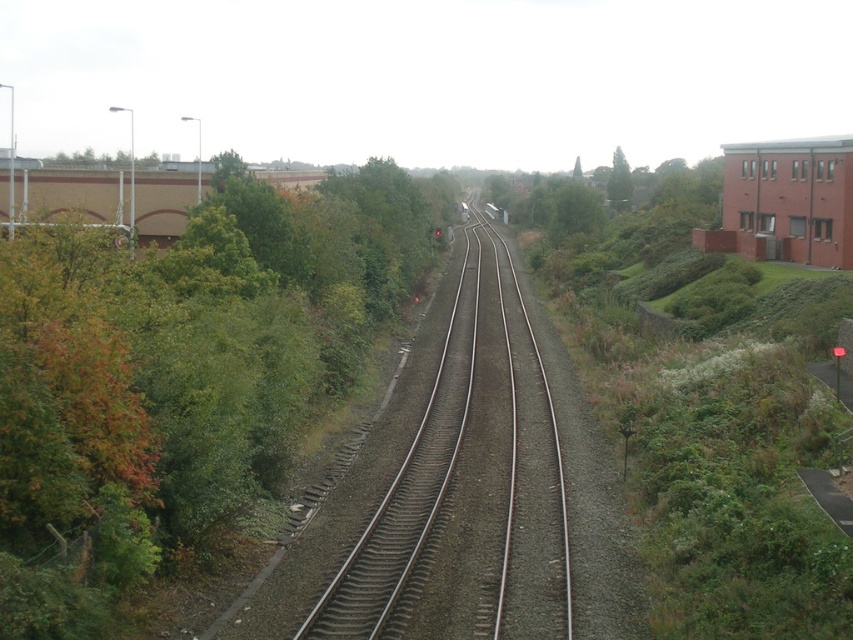
Question: Is green leafy tree at left thinner than green leafy tree at upper center?

Choices:
 (A) yes
 (B) no

Answer: (A)

Question: Which point is closer to the camera?

Choices:
 (A) (474, 602)
 (B) (611, 173)
 (C) (108, 573)

Answer: (C)

Question: Estimate the real-world distances between objects in this image. Which object is farther from the green leafy tree at upper center?

Choices:
 (A) smooth asphalt train track at center
 (B) green leafy tree at left

Answer: (A)

Question: Which point is farther to the camera?

Choices:
 (A) green leafy tree at left
 (B) smooth asphalt train track at center
 (C) green leafy tree at upper center

Answer: (C)

Question: Is the position of green leafy tree at left more distant than that of smooth asphalt train track at center?

Choices:
 (A) yes
 (B) no

Answer: (B)

Question: Observing the image, what is the correct spatial positioning of green leafy tree at left in reference to smooth asphalt train track at center?

Choices:
 (A) left
 (B) right

Answer: (A)